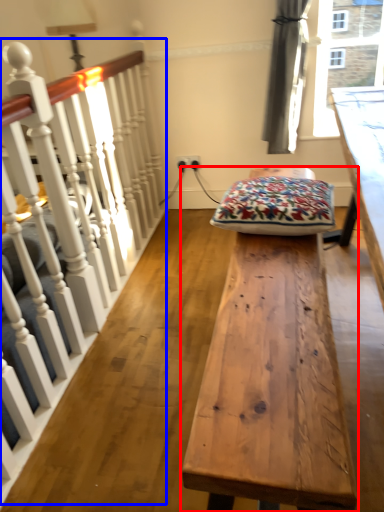
Question: Which of the following is the farthest to the observer, table (highlighted by a red box) or rail (highlighted by a blue box)?

Choices:
 (A) table
 (B) rail

Answer: (A)